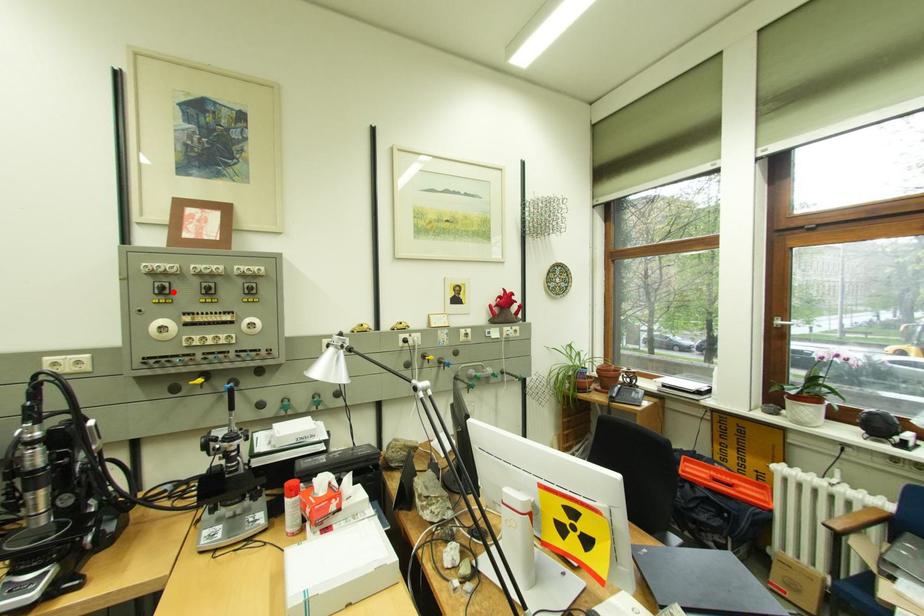
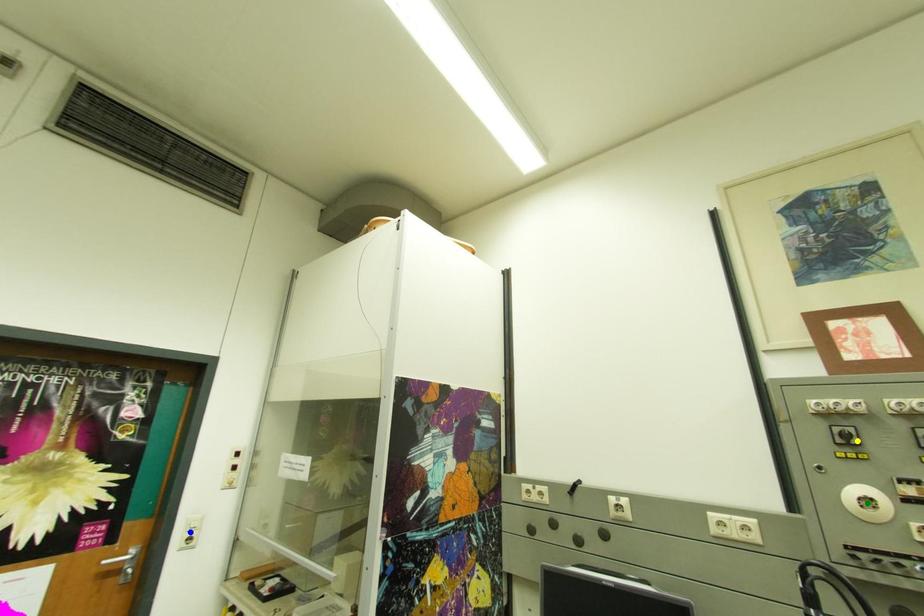
Question: I am providing you with two images of the same scene from different viewpoints. A red point is marked on the first image. You are given multiple points on the second image. Can you choose the point in image 2 that corresponds to the point in image 1?

Choices:
 (A) yellow point
 (B) green point
 (C) blue point

Answer: (A)